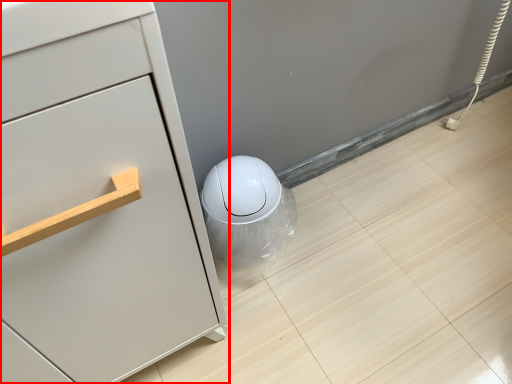
Question: Considering the relative positions of chest of drawers (annotated by the red box) and porcelain in the image provided, where is chest of drawers (annotated by the red box) located with respect to the staircase?

Choices:
 (A) right
 (B) left

Answer: (B)